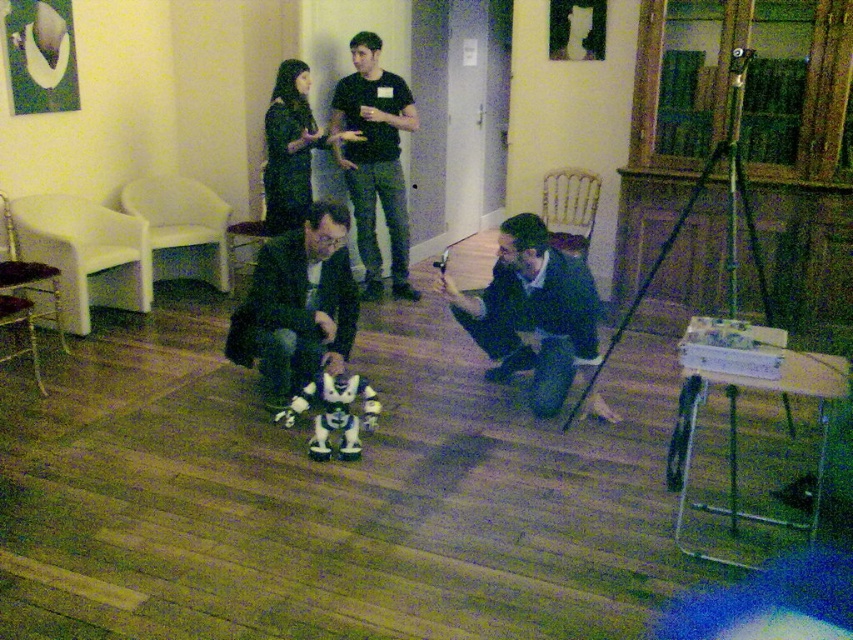
You are standing in the room and want to place a small object exactly halfway between point [280,296] and point [302,120]. Will the object be closer to you or farther away compared to the original points?

The halfway point between point [280,296] and point [302,120] would be closer to the viewer than point [302,120] but farther than point [280,296]. Since point [280,296] is closer to the viewer, the midpoint will be between them, so the object will be closer to you than point [302,120] but not as close as point [280,296].

You are standing in the room and want to ask a question to the person wearing the black matte shirt at upper center. Can you reach them without moving more than 15 feet?

The distance between you and the black matte shirt at upper center is 15.40 feet, which is slightly more than 15 feet. Therefore, you would need to move a little further to reach them.